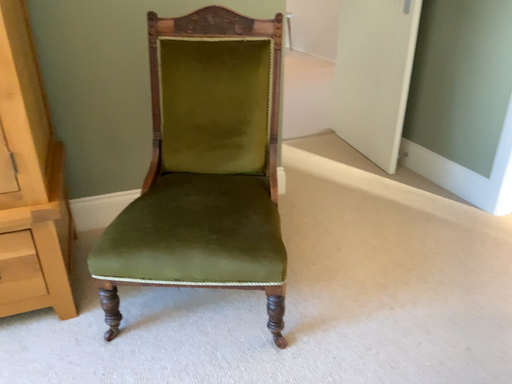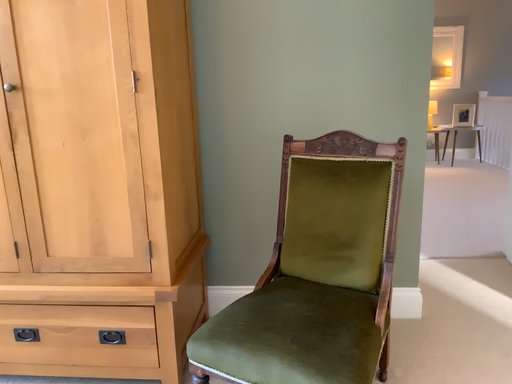
Question: Which way did the camera rotate in the video?

Choices:
 (A) rotated upward
 (B) rotated downward

Answer: (A)